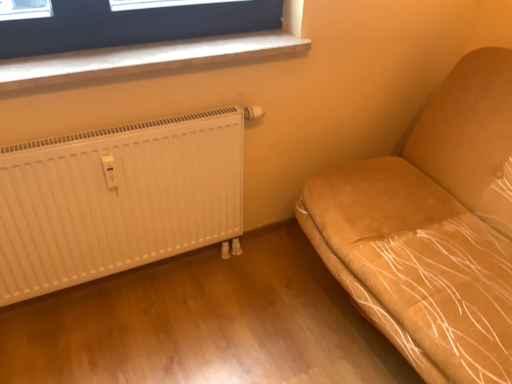
Identify the location of vacant area located to the right-hand side of white ribbed radiator at lower left. (256, 302).